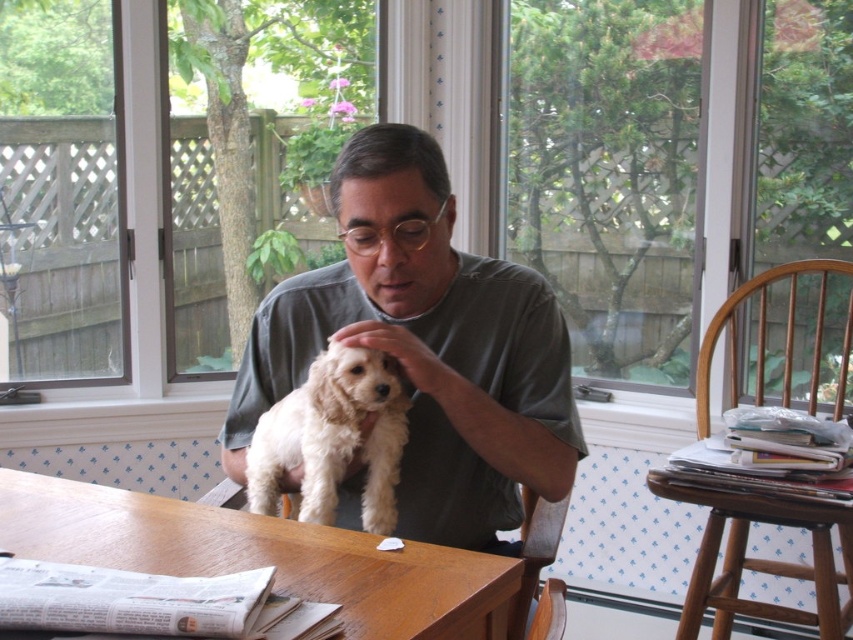
Is gray cotton shirt at center further to camera compared to wooden stool at lower right?

No, it is not.

Does gray cotton shirt at center have a larger size compared to wooden stool at lower right?

Yes, gray cotton shirt at center is bigger than wooden stool at lower right.

Describe the element at coordinates (426, 348) in the screenshot. I see `gray cotton shirt at center` at that location.

At what (x,y) coordinates should I click in order to perform the action: click on gray cotton shirt at center. Please return your answer as a coordinate pair (x, y). This screenshot has height=640, width=853. Looking at the image, I should click on (426, 348).

Does gray cotton shirt at center appear over wooden table at center?

Yes, gray cotton shirt at center is above wooden table at center.

Which of these two, gray cotton shirt at center or wooden table at center, stands taller?

With more height is gray cotton shirt at center.

Is point (474, 483) less distant than point (235, 556)?

No, (474, 483) is behind (235, 556).

Image resolution: width=853 pixels, height=640 pixels. Find the location of `gray cotton shirt at center`. gray cotton shirt at center is located at coordinates point(426,348).

Is the position of wooden table at center less distant than that of white fluffy dog at center?

Yes, it is.

Is wooden table at center shorter than white fluffy dog at center?

Yes, wooden table at center is shorter than white fluffy dog at center.

Is point (401, 609) positioned before point (405, 422)?

Yes, it is in front of point (405, 422).

This screenshot has width=853, height=640. I want to click on wooden table at center, so click(262, 556).